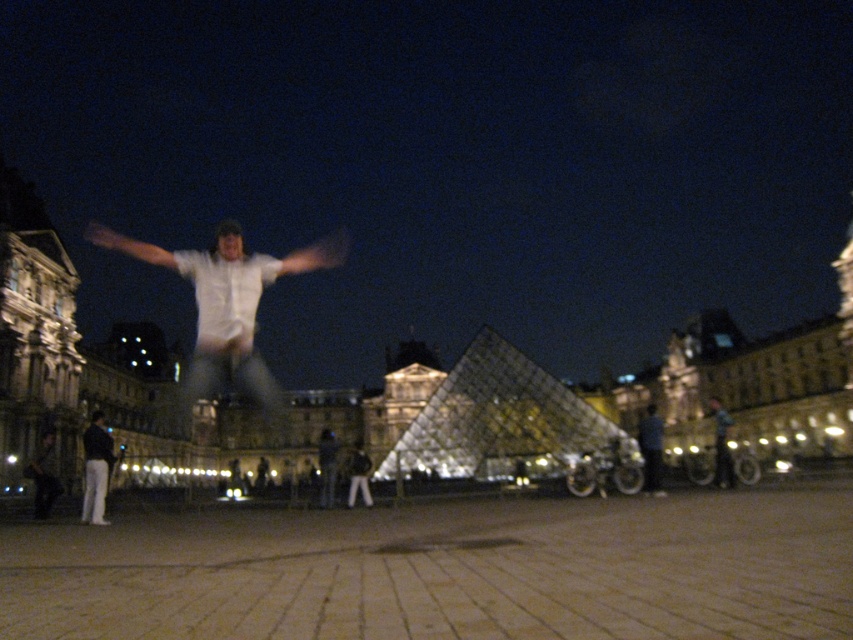
Question: Does white matte shirt at center lie in front of dark blue jeans at lower left?

Choices:
 (A) yes
 (B) no

Answer: (B)

Question: Among these points, which one is nearest to the camera?

Choices:
 (A) (222, 292)
 (B) (83, 440)

Answer: (B)

Question: Is white matte shirt at center wider than dark blue jeans at lower left?

Choices:
 (A) yes
 (B) no

Answer: (A)

Question: Which point is farther to the camera?

Choices:
 (A) white matte shirt at center
 (B) dark blue jeans at lower left

Answer: (A)

Question: In this image, where is white matte shirt at center located relative to dark blue jeans at lower left?

Choices:
 (A) below
 (B) above

Answer: (B)